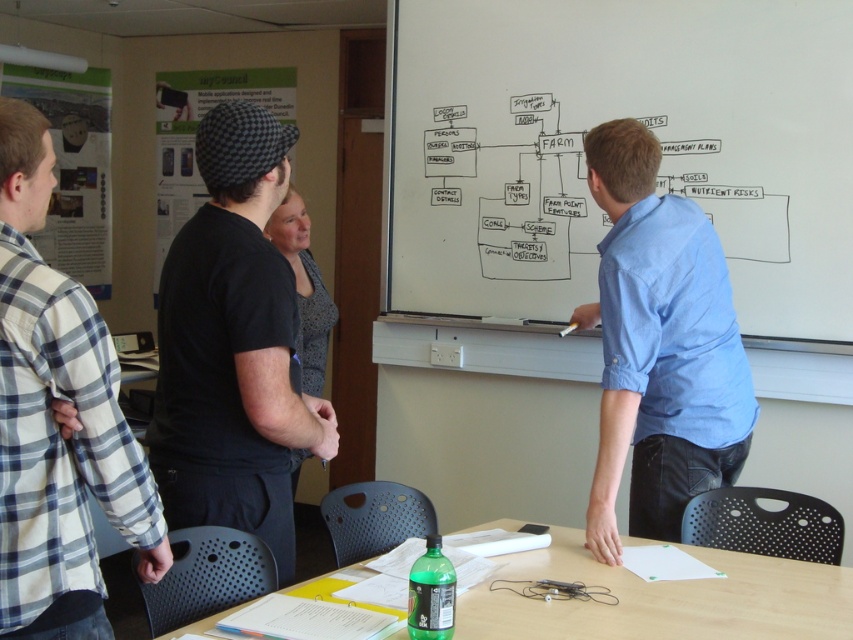
You are standing in the classroom and see two points marked on the whiteboard. The first point is at coordinates point (164, 531) and the second is at point (717, 548). Which point is closer to you?

The point at (164, 531) is closer to the viewer than the point at (717, 548).